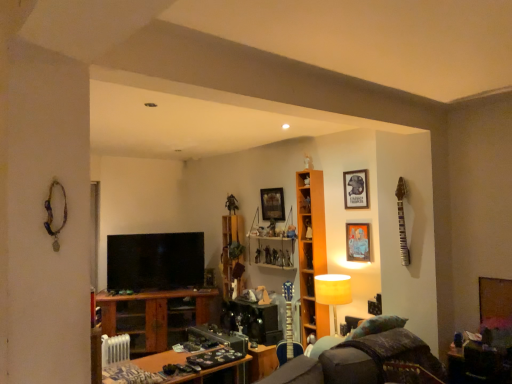
Image resolution: width=512 pixels, height=384 pixels. What are the coordinates of `orange wood shelf at center` in the screenshot? It's located at (311, 251).

The image size is (512, 384). In order to click on matte black tv at center in this screenshot , I will do `click(155, 261)`.

At what (x,y) coordinates should I click in order to perform the action: click on velvet dark brown swivel chair at lower right. Please return your answer as a coordinate pair (x, y). This screenshot has height=384, width=512. Looking at the image, I should click on (365, 358).

What do you see at coordinates (272, 204) in the screenshot?
I see `wooden picture frame at upper center, acting as the 3th picture frame starting from the front` at bounding box center [272, 204].

Find the location of a particular element. This screenshot has height=384, width=512. orange wood shelf at center is located at coordinates (311, 251).

From the picture: Does wooden cabinet at center, placed as the 1th cabinet when sorted from right to left, have a smaller size compared to velvet dark brown swivel chair at lower right?

Correct, wooden cabinet at center, placed as the 1th cabinet when sorted from right to left, occupies less space than velvet dark brown swivel chair at lower right.

Does wooden cabinet at center, arranged as the third cabinet when viewed from the left, have a greater width compared to velvet dark brown swivel chair at lower right?

No.

From a real-world perspective, which is physically above, wooden cabinet at center, which appears as the first cabinet when viewed from the front, or velvet dark brown swivel chair at lower right?

wooden cabinet at center, which appears as the first cabinet when viewed from the front, is physically above.

From the image's perspective, between matte black tv at center and wooden picture frame at upper center, positioned as the 3th picture frame in right-to-left order, who is located below?

matte black tv at center is shown below in the image.

Is matte black tv at center inside the boundaries of wooden picture frame at upper center, positioned as the 3th picture frame in right-to-left order, or outside?

matte black tv at center is outside wooden picture frame at upper center, positioned as the 3th picture frame in right-to-left order.

Starting from the matte black tv at center, which picture frame is the 1st one to the right? Please provide its 2D coordinates.

[(272, 204)]

Considering the positions of points (203, 244) and (280, 216), is point (203, 244) farther from camera compared to point (280, 216)?

Yes, it is behind point (280, 216).

Looking at this image, which is behind, wooden cabinet at center, the first cabinet in the back-to-front sequence, or matte black picture frame at upper right, which is the 1th picture frame from right to left?

wooden cabinet at center, the first cabinet in the back-to-front sequence, is further from the camera.

Looking at the image, does wooden cabinet at center, marked as the 3th cabinet in a right-to-left arrangement, seem bigger or smaller compared to matte black picture frame at upper right, which is the third picture frame from left to right?

wooden cabinet at center, marked as the 3th cabinet in a right-to-left arrangement, is bigger than matte black picture frame at upper right, which is the third picture frame from left to right.

Which is closer to the camera, (234, 232) or (350, 206)?

Point (234, 232).

In terms of height, does wooden cabinet at center, the first cabinet when ordered from left to right, look taller or shorter compared to matte yellow lampshade at center?

Considering their sizes, wooden cabinet at center, the first cabinet when ordered from left to right, has more height than matte yellow lampshade at center.

Between wooden cabinet at center, the first cabinet in the back-to-front sequence, and matte yellow lampshade at center, which one has larger size?

matte yellow lampshade at center.

From a real-world perspective, which is physically below, wooden cabinet at center, marked as the 3th cabinet in a right-to-left arrangement, or matte yellow lampshade at center?

matte yellow lampshade at center is physically lower.

I want to click on lamp in front of the wooden cabinet at center, the first cabinet when ordered from left to right, so click(x=333, y=292).

Considering the relative sizes of metallic figure at upper center and wooden table at lower right, the first table when ordered from front to back, in the image provided, is metallic figure at upper center taller than wooden table at lower right, the first table when ordered from front to back,?

No, metallic figure at upper center is not taller than wooden table at lower right, the first table when ordered from front to back.

Which is more to the left, metallic figure at upper center or wooden table at lower right, which is the 1th table in right-to-left order?

Positioned to the left is metallic figure at upper center.

From a real-world perspective, is metallic figure at upper center below wooden table at lower right, the first table when ordered from front to back?

Actually, metallic figure at upper center is physically above wooden table at lower right, the first table when ordered from front to back, in the real world.

At what (x,y) coordinates should I click in order to perform the action: click on table that is the 2nd one when counting forward from the metallic figure at upper center. Please return your answer as a coordinate pair (x, y). Looking at the image, I should click on (479, 365).

Is matte black tv at center oriented towards orange wood shelf at center?

No, matte black tv at center is not turned towards orange wood shelf at center.

Is matte black tv at center behind orange wood shelf at center?

Yes, matte black tv at center is behind orange wood shelf at center.

Visually, is matte black tv at center positioned to the left or to the right of orange wood shelf at center?

Clearly, matte black tv at center is on the left of orange wood shelf at center in the image.

Considering the relative sizes of matte black tv at center and orange wood shelf at center in the image provided, is matte black tv at center bigger than orange wood shelf at center?

Yes.

Is orange wood shelf at center far away from wooden shelves at center, the 2th cabinet viewed from the front?

No, there isn't a large distance between orange wood shelf at center and wooden shelves at center, the 2th cabinet viewed from the front.

Between orange wood shelf at center and wooden shelves at center, placed as the 2th cabinet when sorted from right to left, which one has smaller size?

orange wood shelf at center is smaller.

Is orange wood shelf at center not within wooden shelves at center, positioned as the second cabinet in left-to-right order?

Yes, orange wood shelf at center is located beyond the bounds of wooden shelves at center, positioned as the second cabinet in left-to-right order.

Locate an element on the screen. Image resolution: width=512 pixels, height=384 pixels. the 2nd cabinet behind when counting from the orange wood shelf at center is located at coordinates tap(271, 251).

Where is `the 1st cabinet to the left of the velvet dark brown swivel chair at lower right, counting from the anchor's position`? the 1st cabinet to the left of the velvet dark brown swivel chair at lower right, counting from the anchor's position is located at coordinates coord(306,228).

Find the location of `television below the wooden picture frame at upper center, acting as the 3th picture frame starting from the front (from the image's perspective)`. television below the wooden picture frame at upper center, acting as the 3th picture frame starting from the front (from the image's perspective) is located at coordinates (155, 261).

From the image, which object appears to be nearer to wooden table at lower left, which appears as the 2th table when viewed from the front, orange wood shelf at center or velvet dark brown swivel chair at lower right?

The object closer to wooden table at lower left, which appears as the 2th table when viewed from the front, is orange wood shelf at center.

Which object lies nearer to the anchor point velvet dark brown swivel chair at lower right, wooden picture frame at upper center, the 1th picture frame positioned from the back, or matte yellow lampshade at center?

Among the two, matte yellow lampshade at center is located nearer to velvet dark brown swivel chair at lower right.

Estimate the real-world distances between objects in this image. Which object is further from wooden table at lower left, which appears as the 2th table when viewed from the right, wooden table at lower right, the first table when ordered from front to back, or wooden shelves at center, the second cabinet in the back-to-front sequence?

Among the two, wooden table at lower right, the first table when ordered from front to back, is located further to wooden table at lower left, which appears as the 2th table when viewed from the right.

Which object lies nearer to the anchor point metallic silver picture frame at upper right, which is the 2th picture frame from right to left, wooden table at lower left, which appears as the 2th table when viewed from the front, or wooden cabinet at center, which is the 3th cabinet from back to front?

The object closer to metallic silver picture frame at upper right, which is the 2th picture frame from right to left, is wooden cabinet at center, which is the 3th cabinet from back to front.

Estimate the real-world distances between objects in this image. Which object is closer to wooden table at lower right, the 2th table from the back, matte black tv at center or wooden picture frame at upper center, acting as the 3th picture frame starting from the front?

wooden picture frame at upper center, acting as the 3th picture frame starting from the front, is closer to wooden table at lower right, the 2th table from the back.

Estimate the real-world distances between objects in this image. Which object is further from metallic figure at upper center, orange wood shelf at center or wooden cabinet at center, which is the 3th cabinet from front to back?

Among the two, orange wood shelf at center is located further to metallic figure at upper center.

Which object lies further to the anchor point matte black picture frame at upper right, which is the 1th picture frame from right to left, wooden cabinet at center, the first cabinet in the back-to-front sequence, or wooden table at lower left, which appears as the 2th table when viewed from the front?

Among the two, wooden table at lower left, which appears as the 2th table when viewed from the front, is located further to matte black picture frame at upper right, which is the 1th picture frame from right to left.

Which object lies nearer to the anchor point metallic figure at upper center, wooden table at lower right, the 2th table from the back, or wooden shelves at center, placed as the 2th cabinet when sorted from right to left?

wooden shelves at center, placed as the 2th cabinet when sorted from right to left.

Where is `shelf between velvet dark brown swivel chair at lower right and wooden shelves at center, placed as the 2th cabinet when sorted from right to left, from front to back`? shelf between velvet dark brown swivel chair at lower right and wooden shelves at center, placed as the 2th cabinet when sorted from right to left, from front to back is located at coordinates (311, 251).

At what (x,y) coordinates should I click in order to perform the action: click on picture frame located between velvet dark brown swivel chair at lower right and matte black picture frame at upper right, which is the third picture frame from left to right, in the depth direction. Please return your answer as a coordinate pair (x, y). The height and width of the screenshot is (384, 512). Looking at the image, I should click on (358, 242).

At what (x,y) coordinates should I click in order to perform the action: click on picture frame located between wooden shelves at center, the 2th cabinet viewed from the front, and metallic figure at upper center in the depth direction. Please return your answer as a coordinate pair (x, y). Looking at the image, I should click on (272, 204).

Image resolution: width=512 pixels, height=384 pixels. Find the location of `table located between matte black tv at center and wooden picture frame at upper center, the 1th picture frame positioned from the back, in the left-right direction`. table located between matte black tv at center and wooden picture frame at upper center, the 1th picture frame positioned from the back, in the left-right direction is located at coordinates (154, 312).